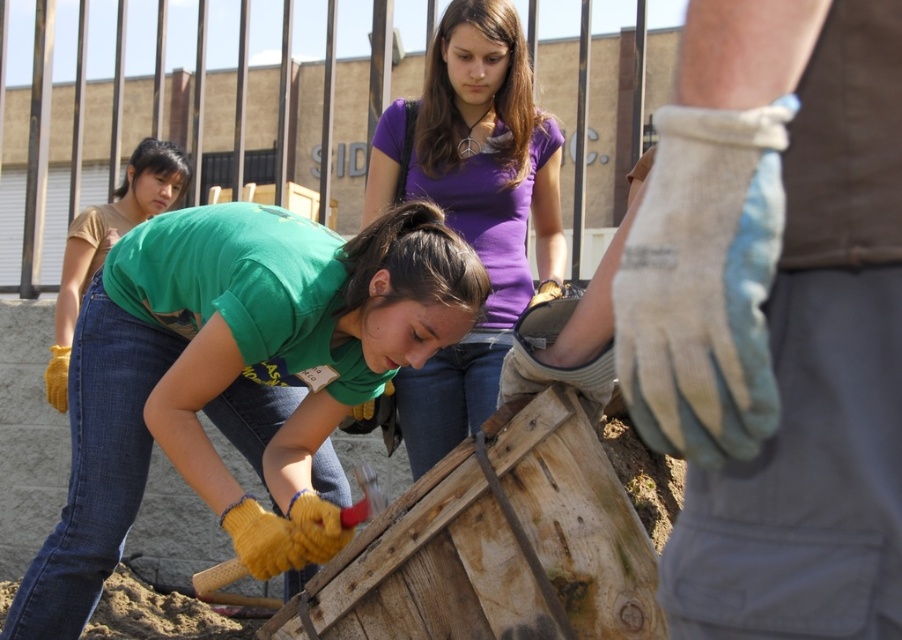
Question: Does matte yellow gloves at lower left appear over purple cotton shirt at upper center?

Choices:
 (A) no
 (B) yes

Answer: (A)

Question: Is matte yellow gloves at lower left below purple cotton shirt at upper center?

Choices:
 (A) yes
 (B) no

Answer: (A)

Question: Is matte yellow gloves at lower left thinner than purple cotton shirt at upper center?

Choices:
 (A) no
 (B) yes

Answer: (A)

Question: Which point is farther to the camera?

Choices:
 (A) purple cotton shirt at upper center
 (B) matte yellow gloves at lower left

Answer: (A)